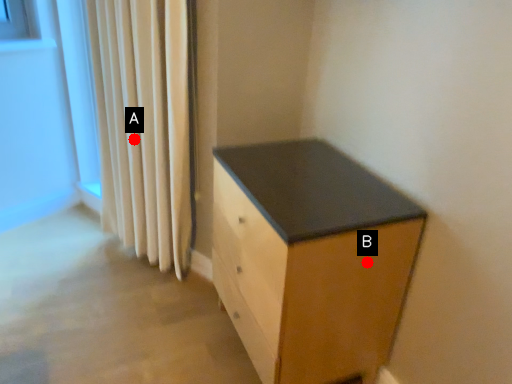
Question: Two points are circled on the image, labeled by A and B beside each circle. Which point is farther to the camera?

Choices:
 (A) A is further
 (B) B is further

Answer: (A)